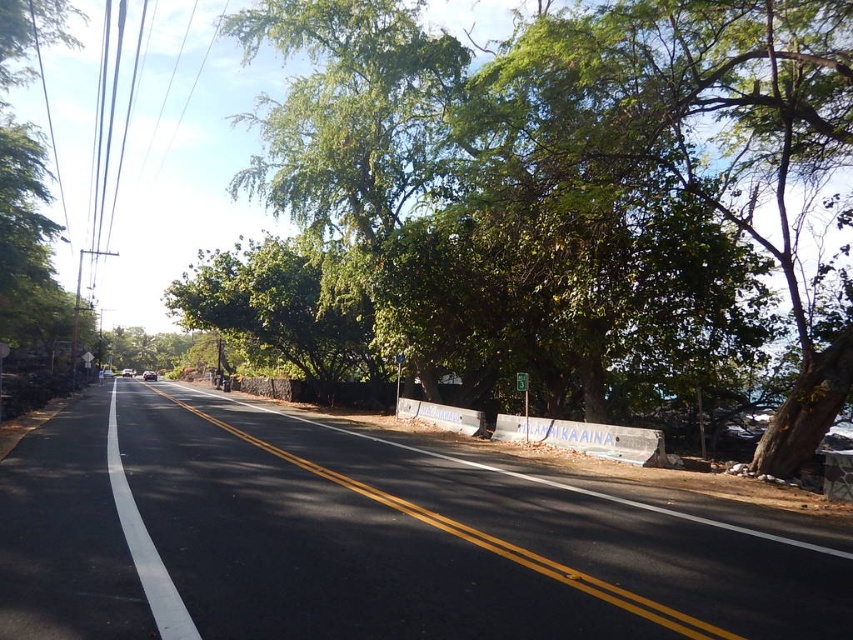
Between black asphalt road at center and white asphalt road at center, which one appears on the left side from the viewer's perspective?

white asphalt road at center

Can you confirm if black asphalt road at center is thinner than white asphalt road at center?

Correct, black asphalt road at center's width is less than white asphalt road at center's.

Is point (700, 621) positioned before point (169, 618)?

Yes.

Locate an element on the screen. This screenshot has width=853, height=640. black asphalt road at center is located at coordinates (492, 541).

Based on the photo, can you confirm if green leafy tree at center is smaller than black asphalt road at center?

No.

Is green leafy tree at center bigger than black asphalt road at center?

Indeed, green leafy tree at center has a larger size compared to black asphalt road at center.

Between point (492, 141) and point (492, 552), which one is positioned behind?

Positioned behind is point (492, 141).

Locate an element on the screen. green leafy tree at center is located at coordinates (572, 186).

Is green leafy tree at center taller than white asphalt road at center?

Yes, green leafy tree at center is taller than white asphalt road at center.

Identify the location of green leafy tree at center. The height and width of the screenshot is (640, 853). (572, 186).

The height and width of the screenshot is (640, 853). What do you see at coordinates (572, 186) in the screenshot? I see `green leafy tree at center` at bounding box center [572, 186].

Where is `green leafy tree at center`? The width and height of the screenshot is (853, 640). green leafy tree at center is located at coordinates (572, 186).